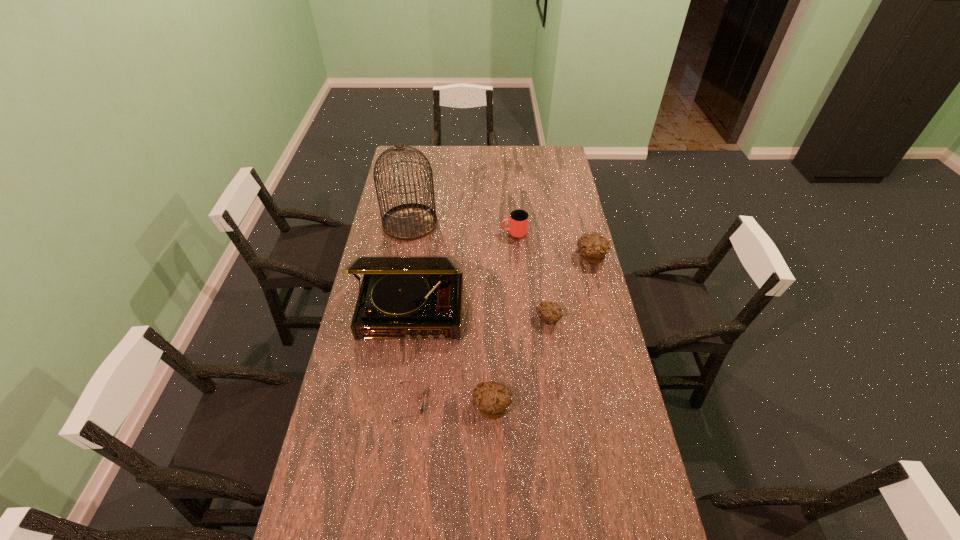
Identify the location of free space that is in between the tallest object and the cup. (462, 228).

At what (x,y) coordinates should I click in order to perform the action: click on vacant area that lies between the record player and the sunglasses. Please return your answer as a coordinate pair (x, y). This screenshot has width=960, height=540. Looking at the image, I should click on (412, 356).

This screenshot has height=540, width=960. In order to click on empty space that is in between the tallest muffin and the cup in this screenshot , I will do `click(552, 245)`.

At what (x,y) coordinates should I click in order to perform the action: click on vacant space that is in between the cup and the record player. Please return your answer as a coordinate pair (x, y). This screenshot has width=960, height=540. Looking at the image, I should click on (463, 272).

Identify the location of blank region between the farthest muffin and the sunglasses. (500, 329).

Where is `unoccupied position between the tallest object and the cup`? unoccupied position between the tallest object and the cup is located at coordinates (462, 228).

Image resolution: width=960 pixels, height=540 pixels. Find the location of `object that is the fourth closest to the fifth tallest object`. object that is the fourth closest to the fifth tallest object is located at coordinates pos(593,247).

Select which object appears as the second closest to the second muffin from right to left. Please provide its 2D coordinates. Your answer should be formatted as a tuple, i.e. [(x, y)], where the tuple contains the x and y coordinates of a point satisfying the conditions above.

[(492, 399)]

Locate an element on the screen. The height and width of the screenshot is (540, 960). muffin that can be found as the closest to the cup is located at coordinates click(x=593, y=247).

Where is `muffin that stands as the third closest to the sixth shortest object`? Image resolution: width=960 pixels, height=540 pixels. muffin that stands as the third closest to the sixth shortest object is located at coordinates (593, 247).